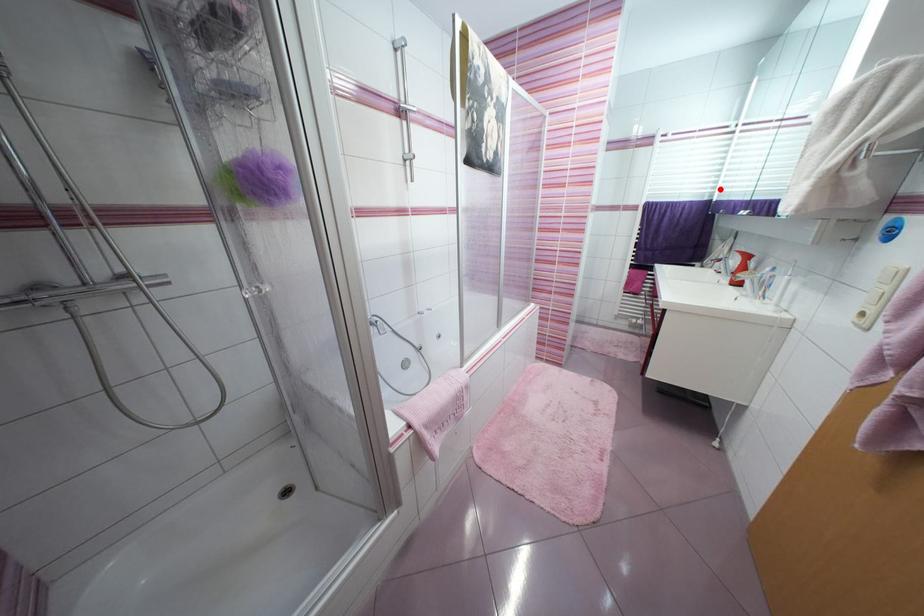
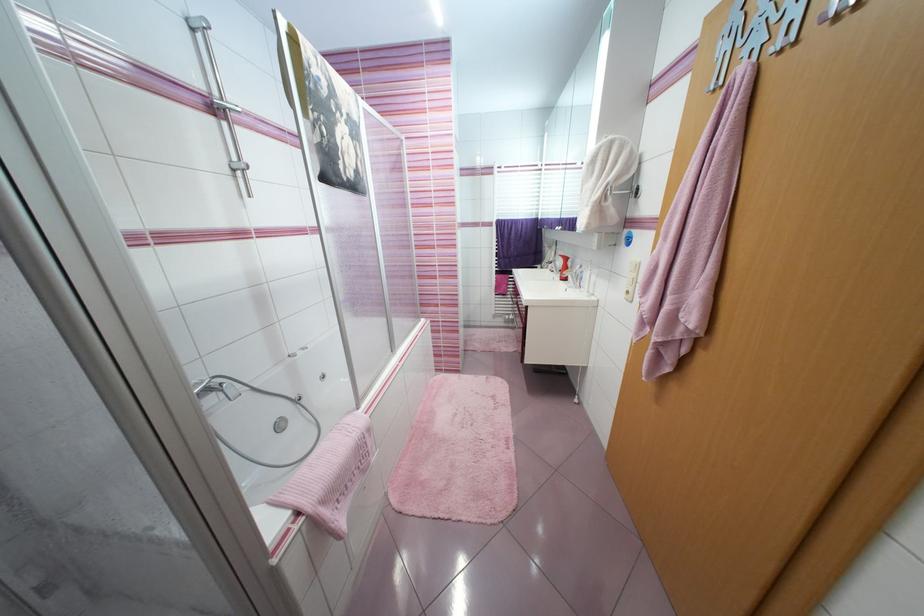
Question: I am providing you with two images of the same scene from different viewpoints. A red point is marked on the first image. At the location where the point appears in image 1, is it still visible in image 2?

Choices:
 (A) Yes
 (B) No

Answer: (A)